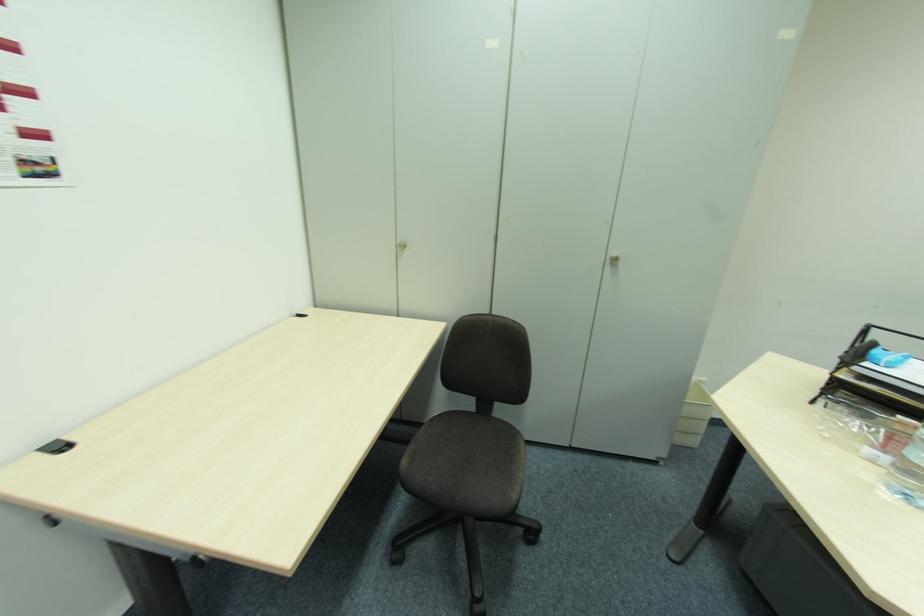
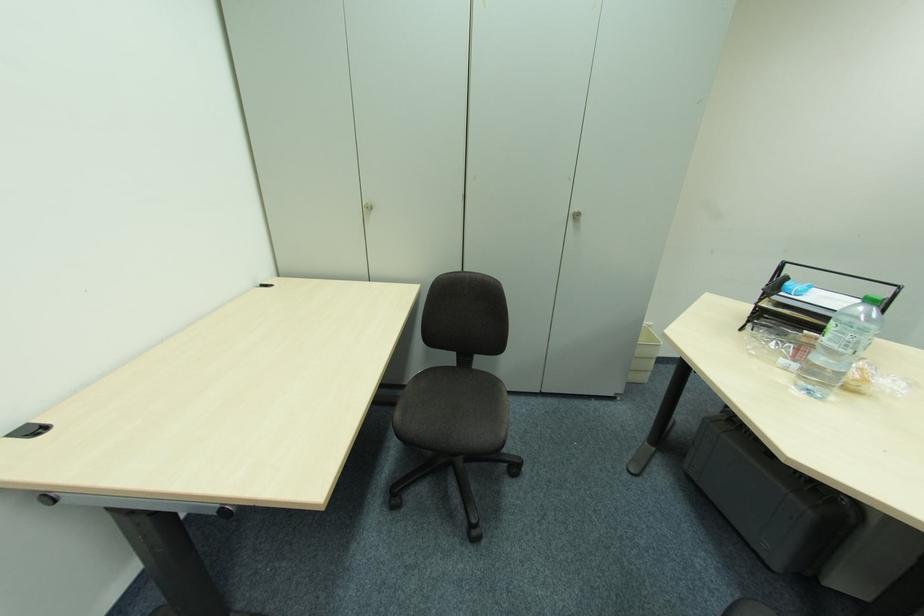
Which direction would the cameraman need to move to produce the second image?

The cameraman moved toward left, backward.